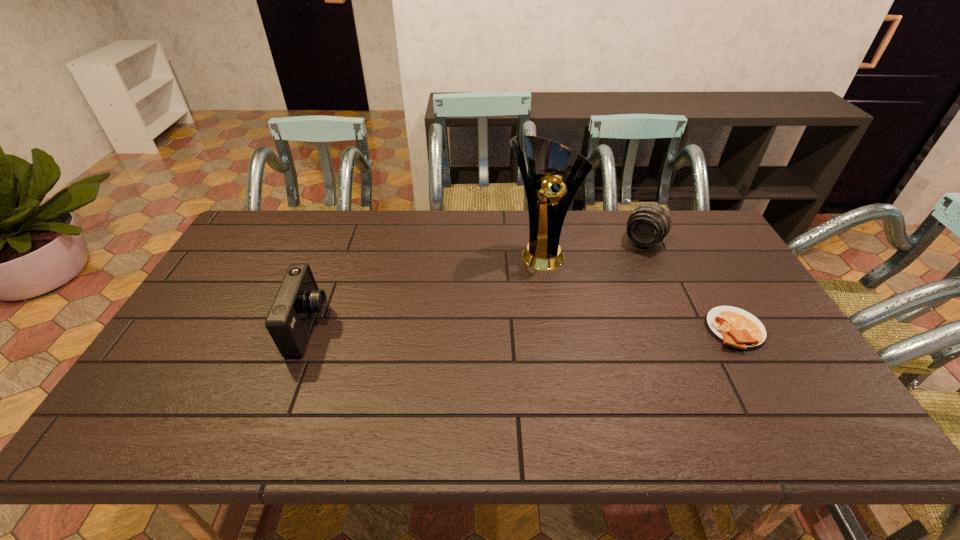
You are a GUI agent. You are given a task and a screenshot of the screen. Output one action in this format:
    pyautogui.click(x=<x>, y=<y>)
    Task: Click on the vacant point located at the front element of the telephoto lens
    This screenshot has width=960, height=540.
    Given the screenshot: What is the action you would take?
    pyautogui.click(x=585, y=328)

You are a GUI agent. You are given a task and a screenshot of the screen. Output one action in this format:
    pyautogui.click(x=<x>, y=<y>)
    Task: Click on the free location located at the front element of the telephoto lens
    The width and height of the screenshot is (960, 540).
    Given the screenshot: What is the action you would take?
    pyautogui.click(x=594, y=315)

This screenshot has height=540, width=960. Find the location of `vacant point located 0.110m at the front element of the telephoto lens`. vacant point located 0.110m at the front element of the telephoto lens is located at coordinates (624, 271).

This screenshot has width=960, height=540. I want to click on award that is at the far edge, so click(548, 197).

You are a GUI agent. You are given a task and a screenshot of the screen. Output one action in this format:
    pyautogui.click(x=<x>, y=<y>)
    Task: Click on the telephoto lens situated at the far edge
    This screenshot has height=540, width=960.
    Given the screenshot: What is the action you would take?
    pyautogui.click(x=648, y=224)

Identify the location of object located at the right edge. The image size is (960, 540). (732, 326).

This screenshot has height=540, width=960. Find the location of `vacant space at the far edge of the desktop`. vacant space at the far edge of the desktop is located at coordinates (478, 228).

The image size is (960, 540). Find the location of `free spot at the near edge of the desktop`. free spot at the near edge of the desktop is located at coordinates (682, 382).

Locate an element on the screen. The height and width of the screenshot is (540, 960). blank space at the left edge of the desktop is located at coordinates (223, 332).

At what (x,y) coordinates should I click in order to perform the action: click on free spot at the right edge of the desktop. Please return your answer as a coordinate pair (x, y). Image resolution: width=960 pixels, height=540 pixels. Looking at the image, I should click on (758, 295).